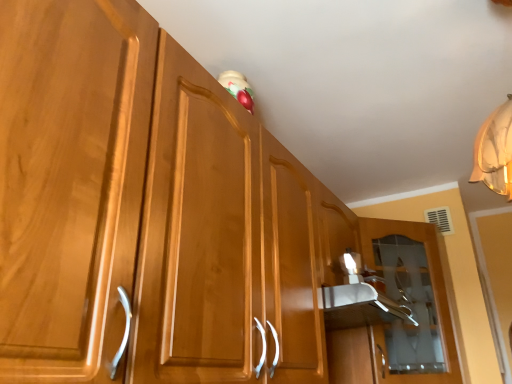
This screenshot has width=512, height=384. I want to click on polished silver faucet at center, so click(x=413, y=300).

What do you see at coordinates (413, 300) in the screenshot? This screenshot has width=512, height=384. I see `polished silver faucet at center` at bounding box center [413, 300].

The width and height of the screenshot is (512, 384). Find the location of `polished silver faucet at center`. polished silver faucet at center is located at coordinates (413, 300).